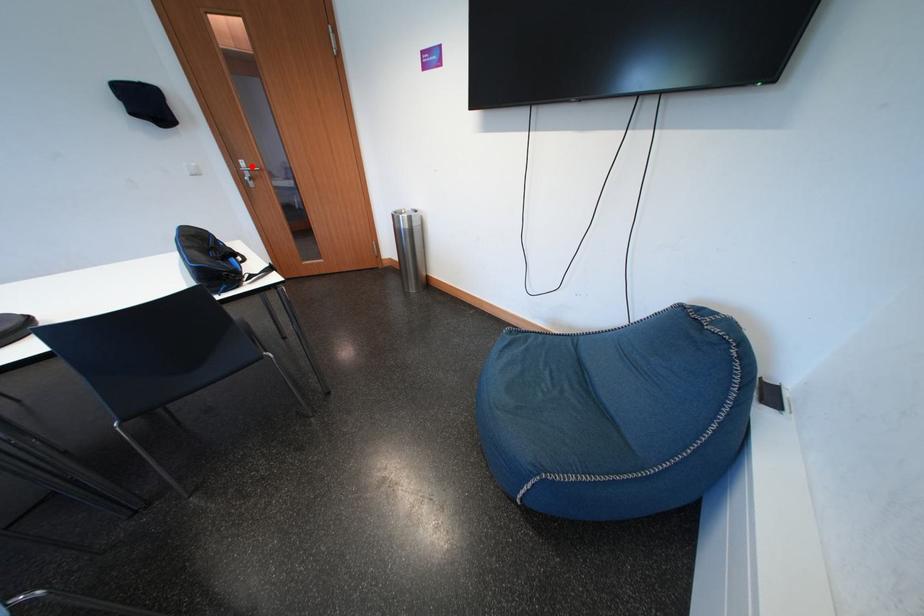
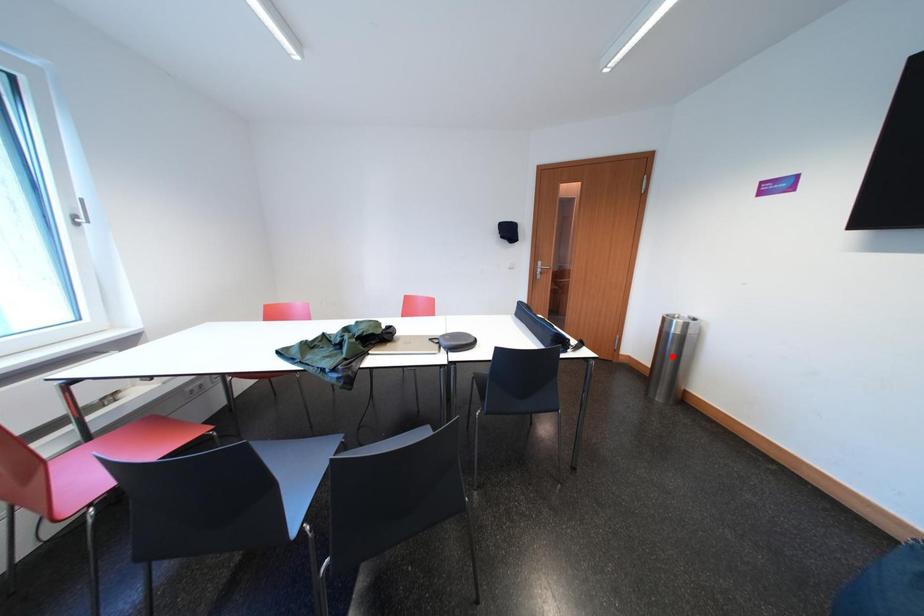
I am providing you with two images of the same scene from different viewpoints. A red point is marked on the first image and another point is marked on the second image. Is the red point in image1 aligned with the point shown in image2?

No